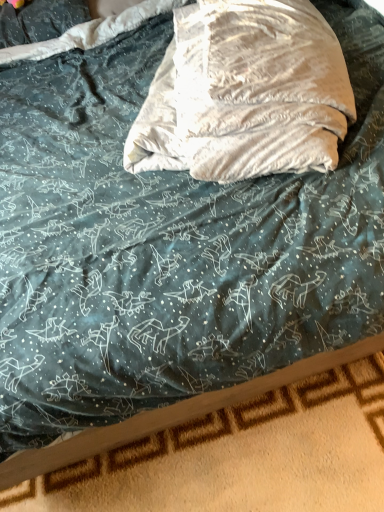
Question: Is wooden bed frame at bottom taller than beige velvety throw pillow at center?

Choices:
 (A) no
 (B) yes

Answer: (A)

Question: Is the position of wooden bed frame at bottom more distant than that of beige velvety throw pillow at center?

Choices:
 (A) no
 (B) yes

Answer: (B)

Question: From a real-world perspective, is wooden bed frame at bottom located beneath beige velvety throw pillow at center?

Choices:
 (A) no
 (B) yes

Answer: (B)

Question: Can you confirm if wooden bed frame at bottom is bigger than beige velvety throw pillow at center?

Choices:
 (A) yes
 (B) no

Answer: (B)

Question: Considering the relative positions of wooden bed frame at bottom and beige velvety throw pillow at center in the image provided, is wooden bed frame at bottom to the right of beige velvety throw pillow at center from the viewer's perspective?

Choices:
 (A) yes
 (B) no

Answer: (B)

Question: Considering the relative sizes of wooden bed frame at bottom and beige velvety throw pillow at center in the image provided, is wooden bed frame at bottom shorter than beige velvety throw pillow at center?

Choices:
 (A) no
 (B) yes

Answer: (B)

Question: Is beige velvety throw pillow at center directly adjacent to wooden bed frame at bottom?

Choices:
 (A) yes
 (B) no

Answer: (B)

Question: Can you confirm if beige velvety throw pillow at center is shorter than wooden bed frame at bottom?

Choices:
 (A) no
 (B) yes

Answer: (A)

Question: From the image's perspective, would you say beige velvety throw pillow at center is positioned over wooden bed frame at bottom?

Choices:
 (A) no
 (B) yes

Answer: (B)

Question: From a real-world perspective, is beige velvety throw pillow at center on wooden bed frame at bottom?

Choices:
 (A) no
 (B) yes

Answer: (B)

Question: Is beige velvety throw pillow at center located outside wooden bed frame at bottom?

Choices:
 (A) no
 (B) yes

Answer: (B)

Question: Is beige velvety throw pillow at center surrounding wooden bed frame at bottom?

Choices:
 (A) no
 (B) yes

Answer: (A)

Question: Looking at their shapes, would you say beige velvety throw pillow at center is wider or thinner than wooden bed frame at bottom?

Choices:
 (A) thin
 (B) wide

Answer: (B)